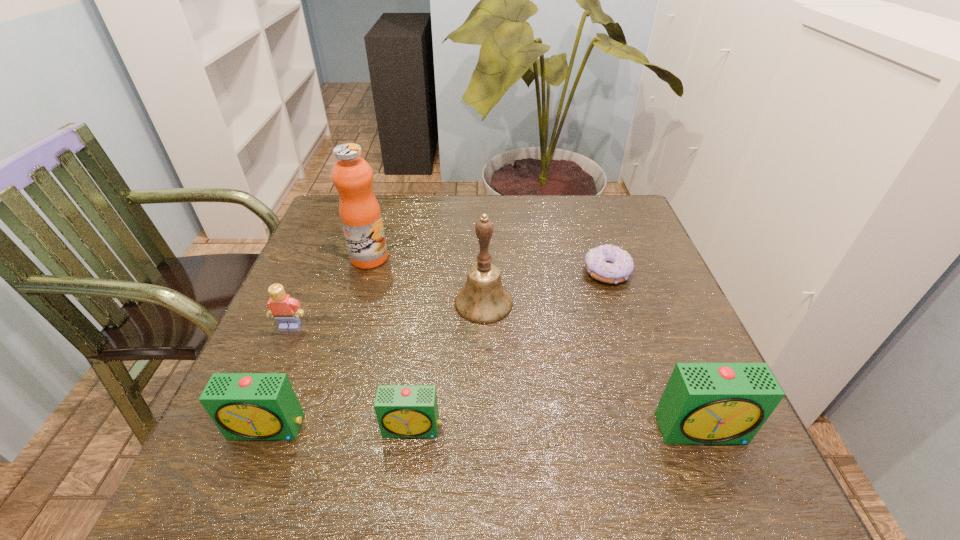
You are a GUI agent. You are given a task and a screenshot of the screen. Output one action in this format:
    pyautogui.click(x=<x>, y=<y>)
    Task: Click on the leftmost alarm clock
    The height and width of the screenshot is (540, 960).
    Given the screenshot: What is the action you would take?
    pyautogui.click(x=244, y=406)

Locate an element on the screen. Image resolution: width=960 pixels, height=540 pixels. the fourth object from right to left is located at coordinates 403,411.

At what (x,y) coordinates should I click in order to perform the action: click on the sixth tallest object. Please return your answer as a coordinate pair (x, y). Looking at the image, I should click on (403, 411).

This screenshot has height=540, width=960. What are the coordinates of `the tallest alarm clock` in the screenshot? It's located at pos(703,403).

Locate an element on the screen. the third tallest object is located at coordinates (703, 403).

The width and height of the screenshot is (960, 540). What are the coordinates of `doughnut` in the screenshot? It's located at (607, 263).

At what (x,y) coordinates should I click in order to perform the action: click on fruit juice. Please return your answer as a coordinate pair (x, y). Looking at the image, I should click on (360, 215).

Where is `Lego`? This screenshot has height=540, width=960. Lego is located at coordinates (286, 310).

The image size is (960, 540). Identify the location of the sixth shortest object. (483, 300).

The image size is (960, 540). In order to click on bell in this screenshot , I will do `click(483, 300)`.